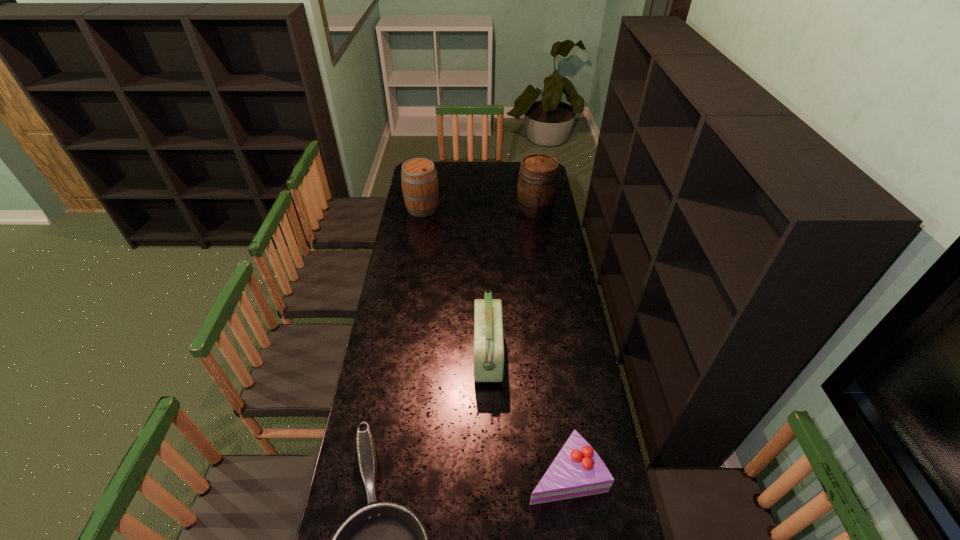
You are a GUI agent. You are given a task and a screenshot of the screen. Output one action in this format:
    pyautogui.click(x=<x>, y=<y>)
    Task: Click on the vacant space that's between the left cider and the third object from left to right
    
    Given the screenshot: What is the action you would take?
    pyautogui.click(x=455, y=282)

Where is `vacant area that lies between the left cider and the right cider`? This screenshot has height=540, width=960. vacant area that lies between the left cider and the right cider is located at coordinates (479, 208).

Identify the location of the fourth closest object to the third object from right to left. The image size is (960, 540). (419, 180).

You are a GUI agent. You are given a task and a screenshot of the screen. Output one action in this format:
    pyautogui.click(x=<x>, y=<y>)
    Task: Click on the object that stands as the third closest to the third object from left to right
    
    Given the screenshot: What is the action you would take?
    pyautogui.click(x=537, y=183)

The image size is (960, 540). I want to click on vacant space that satisfies the following two spatial constraints: 1. on the front panel of the fourth tallest object; 2. on the right side of the radio receiver, so click(490, 472).

Find the location of a particular element. vacant space that satisfies the following two spatial constraints: 1. on the side of the right cider near the bung hole; 2. on the front panel of the radio receiver is located at coordinates (558, 355).

What are the coordinates of `free spot that satisfies the following two spatial constraints: 1. on the front panel of the radio receiver; 2. on the back side of the second shortest object` in the screenshot? It's located at click(490, 472).